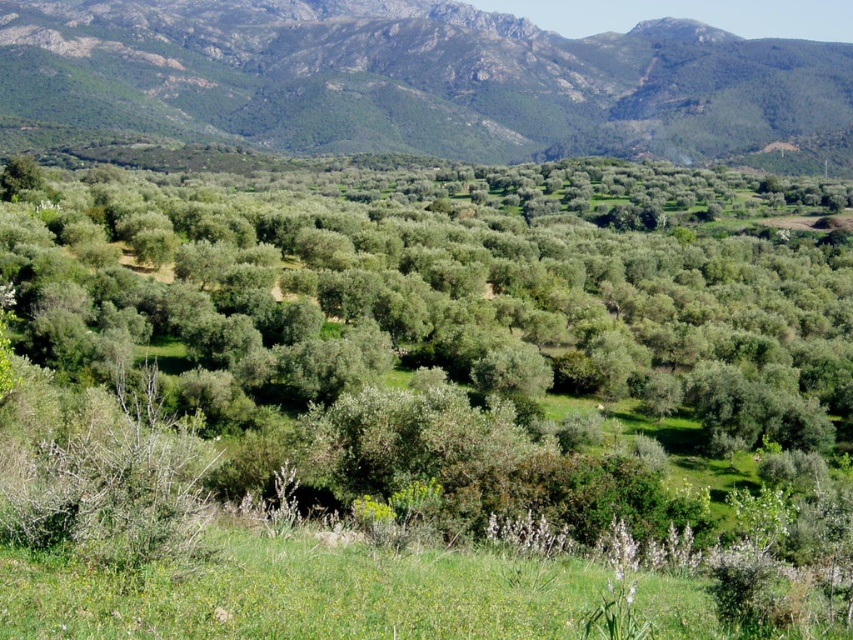
Question: Is green leafy tree at center bigger than green grassy at lower center?

Choices:
 (A) yes
 (B) no

Answer: (A)

Question: Which point is farther to the camera?

Choices:
 (A) green leafy tree at center
 (B) green grassy at lower center

Answer: (A)

Question: Can you confirm if green rocky mountain range at upper center is positioned below green grassy at lower center?

Choices:
 (A) yes
 (B) no

Answer: (B)

Question: Observing the image, what is the correct spatial positioning of green leafy tree at center in reference to green grassy at lower center?

Choices:
 (A) below
 (B) above

Answer: (B)

Question: Which point is closer to the camera?

Choices:
 (A) green grassy at lower center
 (B) green rocky mountain range at upper center

Answer: (A)

Question: Among these points, which one is nearest to the camera?

Choices:
 (A) (97, 115)
 (B) (138, 604)
 (C) (480, 304)

Answer: (B)